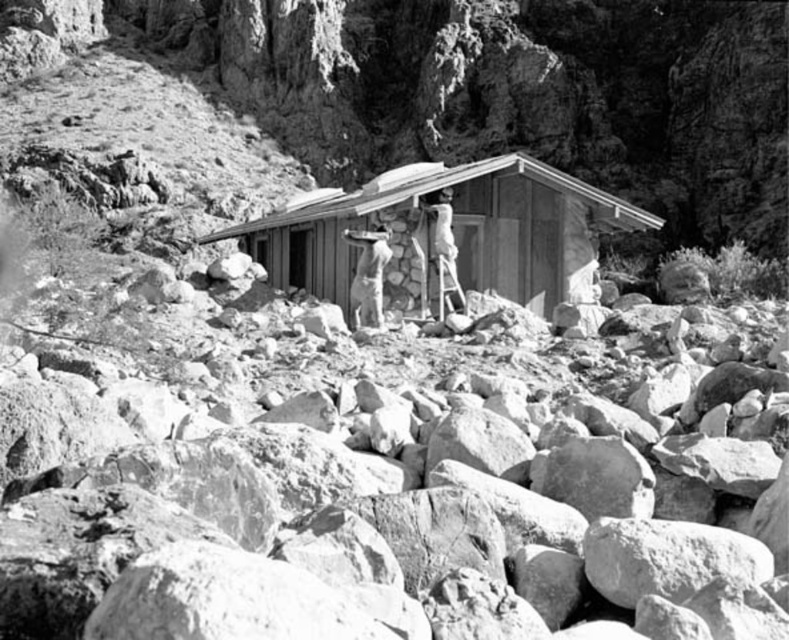
Question: Is wooden cabin at center positioned in front of smooth beige uniform at center?

Choices:
 (A) yes
 (B) no

Answer: (A)

Question: Among these objects, which one is nearest to the camera?

Choices:
 (A) smooth beige uniform at center
 (B) smooth wooden ladder at center
 (C) wooden cabin at center

Answer: (C)

Question: Which object is positioned farthest from the wooden cabin at center?

Choices:
 (A) smooth wooden ladder at center
 (B) smooth beige uniform at center

Answer: (B)

Question: Which point is closer to the camera?

Choices:
 (A) (376, 260)
 (B) (410, 196)

Answer: (A)

Question: From the image, what is the correct spatial relationship of wooden cabin at center in relation to smooth beige uniform at center?

Choices:
 (A) right
 (B) left

Answer: (A)

Question: Does wooden cabin at center have a lesser width compared to smooth beige uniform at center?

Choices:
 (A) yes
 (B) no

Answer: (B)